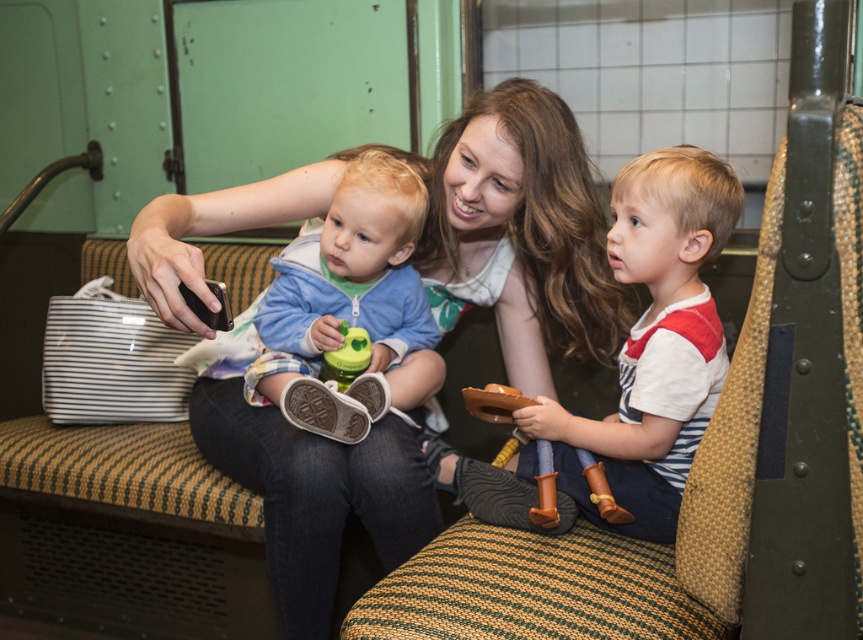
Who is shorter, matte green shirt at center or light blue fleece jacket at center?

light blue fleece jacket at center is shorter.

Can you confirm if matte green shirt at center is smaller than light blue fleece jacket at center?

No.

This screenshot has width=863, height=640. Find the location of `matte green shirt at center`. matte green shirt at center is located at coordinates (446, 228).

Locate an element on the screen. Image resolution: width=863 pixels, height=640 pixels. matte green shirt at center is located at coordinates pyautogui.click(x=446, y=228).

How far apart are striped cotton shirt at center and light blue fleece jacket at center?

A distance of 18.02 inches exists between striped cotton shirt at center and light blue fleece jacket at center.

Who is more forward, [695,189] or [361,268]?

Point [695,189] is more forward.

Is point (620, 497) positioned after point (288, 353)?

No, (620, 497) is in front of (288, 353).

Where is `striped cotton shirt at center`? The image size is (863, 640). striped cotton shirt at center is located at coordinates (654, 339).

Can you confirm if matte green shirt at center is taller than striped cotton shirt at center?

Yes.

Locate an element on the screen. The width and height of the screenshot is (863, 640). matte green shirt at center is located at coordinates (446, 228).